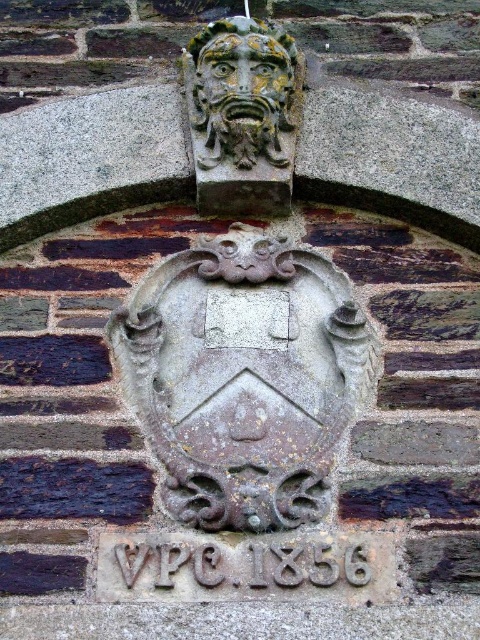
Question: Is gray stone shield at center to the right of carved stone face at upper center from the viewer's perspective?

Choices:
 (A) no
 (B) yes

Answer: (A)

Question: Is gray stone shield at center positioned in front of carved stone face at upper center?

Choices:
 (A) no
 (B) yes

Answer: (B)

Question: Which of the following is the closest to the observer?

Choices:
 (A) carved stone face at upper center
 (B) gray stone shield at center

Answer: (B)

Question: Does gray stone shield at center have a larger size compared to carved stone face at upper center?

Choices:
 (A) yes
 (B) no

Answer: (A)